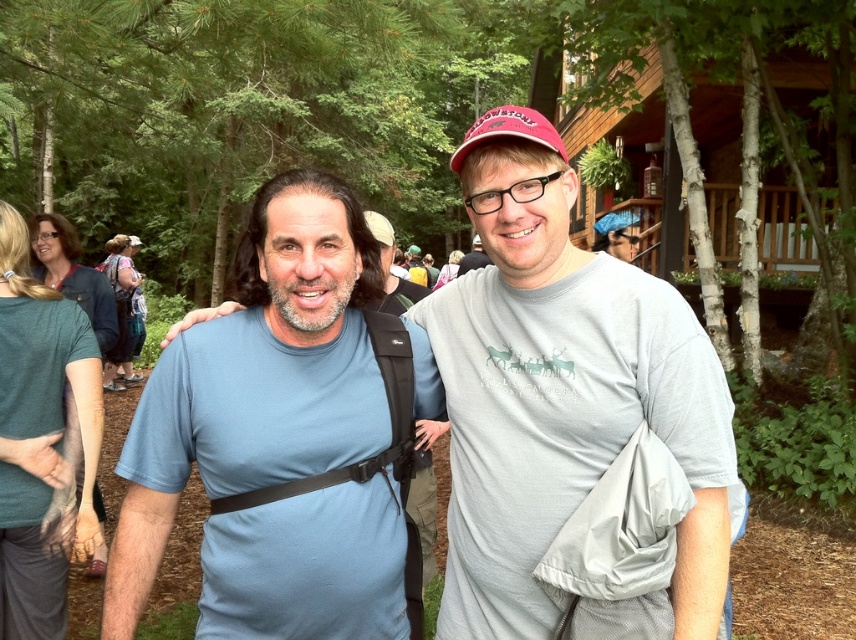
Is green fabric shirt at left to the right of blue fabric cap at upper center from the viewer's perspective?

Incorrect, green fabric shirt at left is not on the right side of blue fabric cap at upper center.

Can you confirm if green fabric shirt at left is taller than blue fabric cap at upper center?

No, green fabric shirt at left is not taller than blue fabric cap at upper center.

Find the location of a particular element. green fabric shirt at left is located at coordinates (73, 276).

Does green fabric shirt at left appear over matte gray t-shirt at center?

Actually, green fabric shirt at left is below matte gray t-shirt at center.

Who is higher up, green fabric shirt at left or matte gray t-shirt at center?

matte gray t-shirt at center is above.

Locate an element on the screen. The image size is (856, 640). green fabric shirt at left is located at coordinates (73, 276).

You are a GUI agent. You are given a task and a screenshot of the screen. Output one action in this format:
    pyautogui.click(x=<x>, y=<y>)
    Task: Click on the green fabric shirt at left
    This screenshot has height=640, width=856.
    Given the screenshot: What is the action you would take?
    pyautogui.click(x=73, y=276)

Between blue cotton t-shirt at center and blue fabric cap at upper center, which one appears on the right side from the viewer's perspective?

Positioned to the right is blue fabric cap at upper center.

Is blue cotton t-shirt at center behind blue fabric cap at upper center?

No, it is not.

At what (x,y) coordinates should I click in order to perform the action: click on blue cotton t-shirt at center. Please return your answer as a coordinate pair (x, y). The height and width of the screenshot is (640, 856). Looking at the image, I should click on (562, 392).

Locate an element on the screen. blue cotton t-shirt at center is located at coordinates (562, 392).